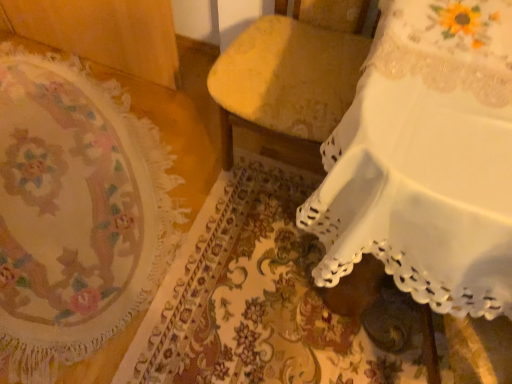
Question: Could you tell me if floral tapestry at left is turned towards velvet yellow chair at center, which ranks as the first furniture in left-to-right order?

Choices:
 (A) no
 (B) yes

Answer: (A)

Question: Considering the relative sizes of floral tapestry at left and velvet yellow chair at center, which appears as the second furniture when viewed from the right, in the image provided, is floral tapestry at left taller than velvet yellow chair at center, which appears as the second furniture when viewed from the right,?

Choices:
 (A) yes
 (B) no

Answer: (B)

Question: From the image's perspective, would you say floral tapestry at left is positioned over velvet yellow chair at center, which ranks as the first furniture in left-to-right order?

Choices:
 (A) no
 (B) yes

Answer: (A)

Question: Considering the relative positions of floral tapestry at left and velvet yellow chair at center, which appears as the second furniture when viewed from the right, in the image provided, is floral tapestry at left to the right of velvet yellow chair at center, which appears as the second furniture when viewed from the right, from the viewer's perspective?

Choices:
 (A) no
 (B) yes

Answer: (A)

Question: From the image's perspective, is floral tapestry at left below velvet yellow chair at center, which ranks as the first furniture in left-to-right order?

Choices:
 (A) no
 (B) yes

Answer: (B)

Question: Is floral tapestry at left located outside velvet yellow chair at center, which appears as the second furniture when viewed from the right?

Choices:
 (A) yes
 (B) no

Answer: (A)

Question: From a real-world perspective, is velvet yellow chair at center, which appears as the second furniture when viewed from the right, located beneath floral tapestry at left?

Choices:
 (A) no
 (B) yes

Answer: (A)

Question: Is velvet yellow chair at center, which appears as the second furniture when viewed from the right, looking in the opposite direction of floral tapestry at left?

Choices:
 (A) no
 (B) yes

Answer: (A)

Question: Is velvet yellow chair at center, which ranks as the first furniture in left-to-right order, closer to the viewer compared to floral tapestry at left?

Choices:
 (A) no
 (B) yes

Answer: (B)

Question: From the image's perspective, is velvet yellow chair at center, which ranks as the first furniture in left-to-right order, over floral tapestry at left?

Choices:
 (A) no
 (B) yes

Answer: (B)

Question: Is floral tapestry at left inside velvet yellow chair at center, which appears as the second furniture when viewed from the right?

Choices:
 (A) yes
 (B) no

Answer: (B)

Question: Can you confirm if velvet yellow chair at center, which ranks as the first furniture in left-to-right order, is smaller than floral tapestry at left?

Choices:
 (A) no
 (B) yes

Answer: (A)

Question: Can you confirm if white lace tablecloth at upper right, which appears as the second furniture when viewed from the left, is shorter than velvet yellow chair at center, which appears as the second furniture when viewed from the right?

Choices:
 (A) no
 (B) yes

Answer: (B)